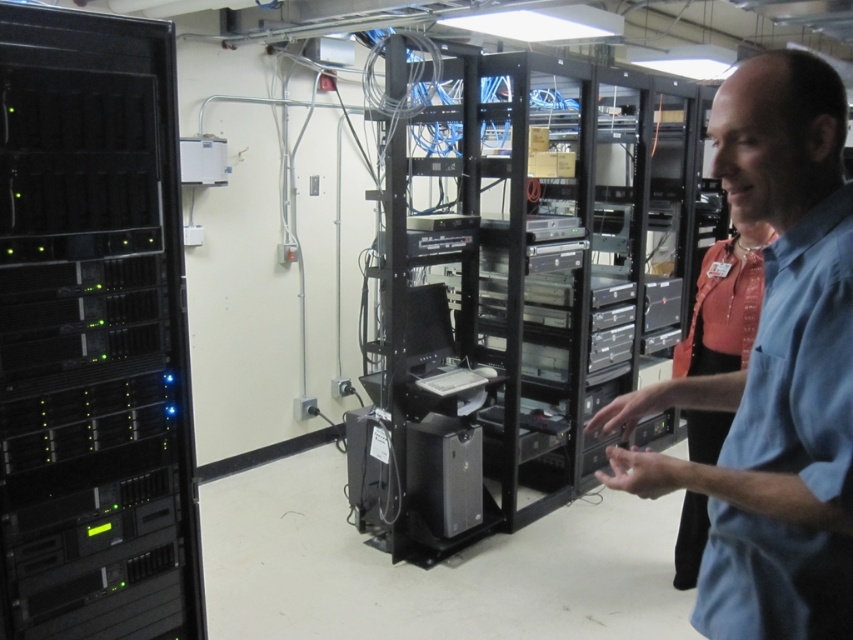
You are a technician in the server room. You need to access both points labeled as point (x=397, y=340) and point (x=96, y=129). Which point should you approach first to reach the one that is closer to you?

Point (x=96, y=129) is closer to you, so you should approach it first before moving to the point (x=397, y=340) which is further away.

You are a technician in a server room. You need to install a new server that requires a rack with more vertical space. Based on the image, which object between the black metal server rack at center and the black metallic server at left should you choose?

The black metal server rack at center has a greater height compared to the black metallic server at left, so you should choose the black metal server rack at center for installing the new server that requires more vertical space.

You are a technician in the server room and need to access the blue shirt at center. However, the black metallic server at left is blocking your path. Can you move around the server to reach the shirt?

The black metallic server at left might be wider than blue shirt at center, so it is possible that the server is blocking the path. You may need to find an alternative route or move the server to access the blue shirt at center.